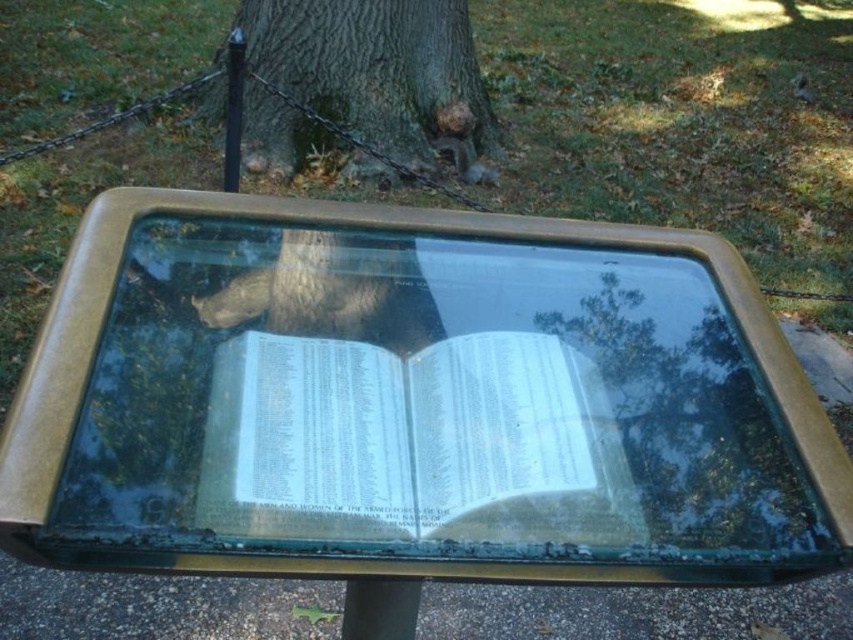
Question: Which point appears farthest from the camera in this image?

Choices:
 (A) (474, 333)
 (B) (465, 168)
 (C) (779, 416)
 (D) (271, 35)

Answer: (B)

Question: Does green patina glass table at center appear on the left side of gray fur squirrel at upper center?

Choices:
 (A) no
 (B) yes

Answer: (B)

Question: Considering the real-world distances, which object is farthest from the green patina glass table at center?

Choices:
 (A) white paper book at center
 (B) green rough bark tree at center
 (C) gray fur squirrel at upper center

Answer: (C)

Question: Can you confirm if green patina glass table at center is positioned below green rough bark tree at center?

Choices:
 (A) no
 (B) yes

Answer: (B)

Question: Which of the following is the farthest from the observer?

Choices:
 (A) (405, 456)
 (B) (363, 240)

Answer: (B)

Question: Considering the relative positions of green patina glass table at center and gray fur squirrel at upper center in the image provided, where is green patina glass table at center located with respect to gray fur squirrel at upper center?

Choices:
 (A) above
 (B) below

Answer: (B)